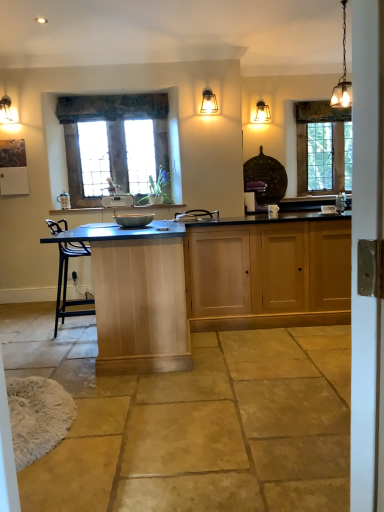
The image size is (384, 512). I want to click on light oak cabinet at center, the second cabinetry from the left, so click(268, 275).

In order to face metallic chain-link light fixture at upper right, which is counted as the 3th light fixture, starting from the left, should I rotate leftwards or rightwards?

Rotate right and turn 19.852 degrees.

Describe the element at coordinates (208, 102) in the screenshot. This screenshot has height=512, width=384. I see `matte glass light fixture at upper center, arranged as the first light fixture when viewed from the left` at that location.

Where is `stained glass window at center, acting as the second window starting from the right`? stained glass window at center, acting as the second window starting from the right is located at coordinates (116, 144).

The height and width of the screenshot is (512, 384). In order to click on white plastic radio at center, the 1th appliance from the top in this screenshot , I will do `click(118, 201)`.

Which object is closer to the camera taking this photo, metallic chain-link light fixture at upper right, arranged as the 3th light fixture when viewed from the back, or light oak cabinet at center, the first cabinetry positioned from the right?

metallic chain-link light fixture at upper right, arranged as the 3th light fixture when viewed from the back, is more forward.

In the scene shown: Who is shorter, metallic chain-link light fixture at upper right, arranged as the 3th light fixture when viewed from the back, or light oak cabinet at center, the first cabinetry positioned from the right?

metallic chain-link light fixture at upper right, arranged as the 3th light fixture when viewed from the back.

Is light oak cabinet at center, the second cabinetry from the left, located within metallic chain-link light fixture at upper right, arranged as the 3th light fixture when viewed from the back?

No, light oak cabinet at center, the second cabinetry from the left, is located outside of metallic chain-link light fixture at upper right, arranged as the 3th light fixture when viewed from the back.

Which light fixture is the 2nd one when counting from the right side of the light oak cabinet at center, the second cabinetry from the left? Please provide its 2D coordinates.

[(342, 76)]

Is point (322, 210) closer to viewer compared to point (264, 103)?

Yes, it is.

Is white glossy sink at center thinner than matte glass pendant light at upper center, positioned as the 3th light fixture in front-to-back order?

Correct, the width of white glossy sink at center is less than that of matte glass pendant light at upper center, positioned as the 3th light fixture in front-to-back order.

Does white glossy sink at center have a smaller size compared to matte glass pendant light at upper center, arranged as the 2th light fixture when viewed from the left?

Correct, white glossy sink at center occupies less space than matte glass pendant light at upper center, arranged as the 2th light fixture when viewed from the left.

This screenshot has height=512, width=384. In order to click on light fixture that is the 2nd one when counting leftward from the white glossy sink at center in this screenshot , I will do `click(262, 112)`.

Considering their positions, is textured fabric curtain at upper center located in front of or behind white glossy sink at center?

textured fabric curtain at upper center is positioned farther from the viewer than white glossy sink at center.

Is textured fabric curtain at upper center next to white glossy sink at center and touching it?

No.

Considering the relative sizes of light wood cabinet at center, positioned as the 1th cabinetry in left-to-right order, and matte glass pendant light at upper center, positioned as the 3th light fixture in front-to-back order, in the image provided, is light wood cabinet at center, positioned as the 1th cabinetry in left-to-right order, bigger than matte glass pendant light at upper center, positioned as the 3th light fixture in front-to-back order,?

Yes, light wood cabinet at center, positioned as the 1th cabinetry in left-to-right order, is bigger than matte glass pendant light at upper center, positioned as the 3th light fixture in front-to-back order.

From the image's perspective, does light wood cabinet at center, marked as the 2th cabinetry in a right-to-left arrangement, appear higher than matte glass pendant light at upper center, arranged as the 2th light fixture when viewed from the left?

No.

From a real-world perspective, is light wood cabinet at center, positioned as the 1th cabinetry in left-to-right order, located higher than matte glass pendant light at upper center, positioned as the 1th light fixture in back-to-front order?

No, from a real-world perspective, light wood cabinet at center, positioned as the 1th cabinetry in left-to-right order, is not on top of matte glass pendant light at upper center, positioned as the 1th light fixture in back-to-front order.

Which object is positioned more to the left, light wood cabinet at center, positioned as the 1th cabinetry in left-to-right order, or matte glass pendant light at upper center, positioned as the 3th light fixture in front-to-back order?

From the viewer's perspective, light wood cabinet at center, positioned as the 1th cabinetry in left-to-right order, appears more on the left side.

Does metallic chain-link light fixture at upper right, arranged as the 3th light fixture when viewed from the back, have a lesser width compared to matte glass pendant light at upper center, arranged as the 2th light fixture when viewed from the left?

Yes, metallic chain-link light fixture at upper right, arranged as the 3th light fixture when viewed from the back, is thinner than matte glass pendant light at upper center, arranged as the 2th light fixture when viewed from the left.

From the picture: Considering the relative positions of metallic chain-link light fixture at upper right, which is counted as the 3th light fixture, starting from the left, and matte glass pendant light at upper center, which appears as the 2th light fixture when viewed from the right, in the image provided, is metallic chain-link light fixture at upper right, which is counted as the 3th light fixture, starting from the left, to the right of matte glass pendant light at upper center, which appears as the 2th light fixture when viewed from the right, from the viewer's perspective?

Yes.

Is metallic chain-link light fixture at upper right, which is counted as the 3th light fixture, starting from the left, inside the boundaries of matte glass pendant light at upper center, arranged as the 2th light fixture when viewed from the left, or outside?

metallic chain-link light fixture at upper right, which is counted as the 3th light fixture, starting from the left, is not enclosed by matte glass pendant light at upper center, arranged as the 2th light fixture when viewed from the left.

Is metallic chain-link light fixture at upper right, the 1th light fixture viewed from the right, next to matte glass pendant light at upper center, positioned as the 3th light fixture in front-to-back order?

No, metallic chain-link light fixture at upper right, the 1th light fixture viewed from the right, is not in contact with matte glass pendant light at upper center, positioned as the 3th light fixture in front-to-back order.

From their relative heights in the image, would you say white painted wood screen door at right is taller or shorter than stained glass window at upper right, marked as the 2th window in a left-to-right arrangement?

In the image, white painted wood screen door at right appears to be taller than stained glass window at upper right, marked as the 2th window in a left-to-right arrangement.

Between white painted wood screen door at right and stained glass window at upper right, which ranks as the second window in front-to-back order, which one has larger width?

white painted wood screen door at right.

From a real-world perspective, between white painted wood screen door at right and stained glass window at upper right, marked as the 2th window in a left-to-right arrangement, who is vertically higher?

stained glass window at upper right, marked as the 2th window in a left-to-right arrangement, is physically above.

From a real-world perspective, which object stands above the other?

white plastic radio at center, the 1th appliance from the top, from a real-world perspective.

Considering the relative sizes of white plastic radio at center, the 1th appliance in the left-to-right sequence, and light oak cabinet at center, the first cabinetry positioned from the right, in the image provided, is white plastic radio at center, the 1th appliance in the left-to-right sequence, thinner than light oak cabinet at center, the first cabinetry positioned from the right,?

Correct, the width of white plastic radio at center, the 1th appliance in the left-to-right sequence, is less than that of light oak cabinet at center, the first cabinetry positioned from the right.

Who is shorter, white plastic radio at center, acting as the second appliance starting from the front, or light oak cabinet at center, the first cabinetry positioned from the right?

white plastic radio at center, acting as the second appliance starting from the front, is shorter.

Find the location of a particular element. The width and height of the screenshot is (384, 512). cabinetry behind the metallic chain-link light fixture at upper right, the 1th light fixture viewed from the right is located at coordinates (268, 275).

You are a GUI agent. You are given a task and a screenshot of the screen. Output one action in this format:
    pyautogui.click(x=<x>, y=<y>)
    Task: Click on the sink below the matte glass pendant light at upper center, positioned as the 3th light fixture in front-to-back order (from the image's perspective)
    
    Given the screenshot: What is the action you would take?
    337,205

Based on their spatial positions, is white plastic radio at center, the 1th appliance in the left-to-right sequence, or matte glass light fixture at upper center, positioned as the 2th light fixture in back-to-front order, closer to stained glass window at upper right, marked as the 2th window in a left-to-right arrangement?

The object closer to stained glass window at upper right, marked as the 2th window in a left-to-right arrangement, is matte glass light fixture at upper center, positioned as the 2th light fixture in back-to-front order.

Looking at the image, which one is located closer to white painted wood screen door at right, matte glass light fixture at upper center, the second light fixture in the front-to-back sequence, or light oak cabinet at center, the first cabinetry positioned from the right?

light oak cabinet at center, the first cabinetry positioned from the right, is closer to white painted wood screen door at right.

Based on their spatial positions, is white painted wood screen door at right or stained glass window at upper right, the first window viewed from the back, closer to white plastic radio at center, the 1th appliance from the top?

Based on the image, stained glass window at upper right, the first window viewed from the back, appears to be nearer to white plastic radio at center, the 1th appliance from the top.

Which object lies further to the anchor point white glossy sink at center, metallic chain-link light fixture at upper right, which is counted as the 3th light fixture, starting from the left, or textured fabric curtain at upper center?

Among the two, textured fabric curtain at upper center is located further to white glossy sink at center.

Looking at the image, which one is located further to stained glass window at center, acting as the second window starting from the right, metallic gray bowl at center, positioned as the second appliance in back-to-front order, or light wood cabinet at center, marked as the 2th cabinetry in a right-to-left arrangement?

Among the two, light wood cabinet at center, marked as the 2th cabinetry in a right-to-left arrangement, is located further to stained glass window at center, acting as the second window starting from the right.

When comparing their distances from stained glass window at upper right, which ranks as the second window in front-to-back order, does metallic chain-link light fixture at upper right, which is counted as the 3th light fixture, starting from the left, or metallic gray bowl at center, marked as the second appliance in a left-to-right arrangement, seem closer?

Based on the image, metallic chain-link light fixture at upper right, which is counted as the 3th light fixture, starting from the left, appears to be nearer to stained glass window at upper right, which ranks as the second window in front-to-back order.

Which object lies nearer to the anchor point white painted wood screen door at right, light oak cabinet at center, the first cabinetry positioned from the right, or textured fabric curtain at upper center?

light oak cabinet at center, the first cabinetry positioned from the right, is closer to white painted wood screen door at right.

Looking at the image, which one is located further to white glossy sink at center, metallic chain-link light fixture at upper right, the 1th light fixture viewed from the right, or white painted wood screen door at right?

white painted wood screen door at right is positioned further to the anchor white glossy sink at center.

Where is `light fixture between white painted wood screen door at right and light oak cabinet at center, the first cabinetry positioned from the right, in the front-back direction`? This screenshot has width=384, height=512. light fixture between white painted wood screen door at right and light oak cabinet at center, the first cabinetry positioned from the right, in the front-back direction is located at coordinates (342, 76).

What are the coordinates of `appliance between white painted wood screen door at right and matte glass light fixture at upper center, arranged as the first light fixture when viewed from the left, from front to back` in the screenshot? It's located at (133, 219).

What are the coordinates of `cabinetry between light wood cabinet at center, marked as the 2th cabinetry in a right-to-left arrangement, and textured fabric curtain at upper center from front to back` in the screenshot? It's located at (268, 275).

You are a GUI agent. You are given a task and a screenshot of the screen. Output one action in this format:
    pyautogui.click(x=<x>, y=<y>)
    Task: Click on the cabinetry between light wood cabinet at center, positioned as the 1th cabinetry in left-to-right order, and white plastic radio at center, the 1th appliance from the top, in the front-back direction
    
    Given the screenshot: What is the action you would take?
    pyautogui.click(x=268, y=275)